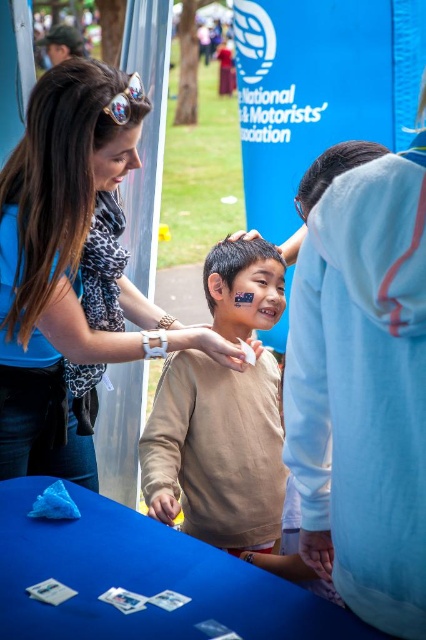
You are standing in the park and see two points in the scene. Which point is closer to you, point (120, 170) or point (78, 109)?

Point (120, 170) is closer to you because it is further to the viewer than point (78, 109).

You are standing at the origin point in the image. Where is the black smooth hair at upper center located in terms of coordinates?

The black smooth hair at upper center is located at coordinates point (x=333, y=170).